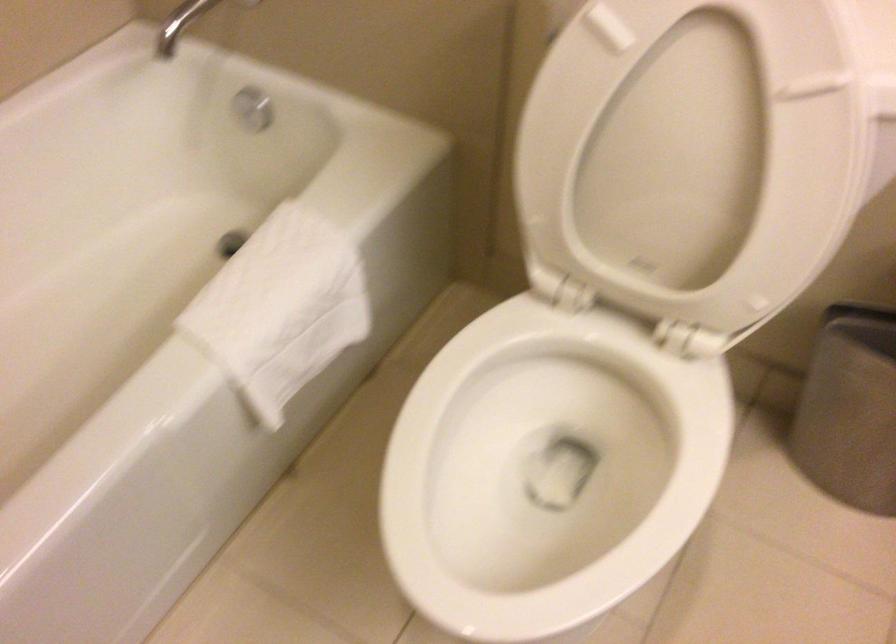
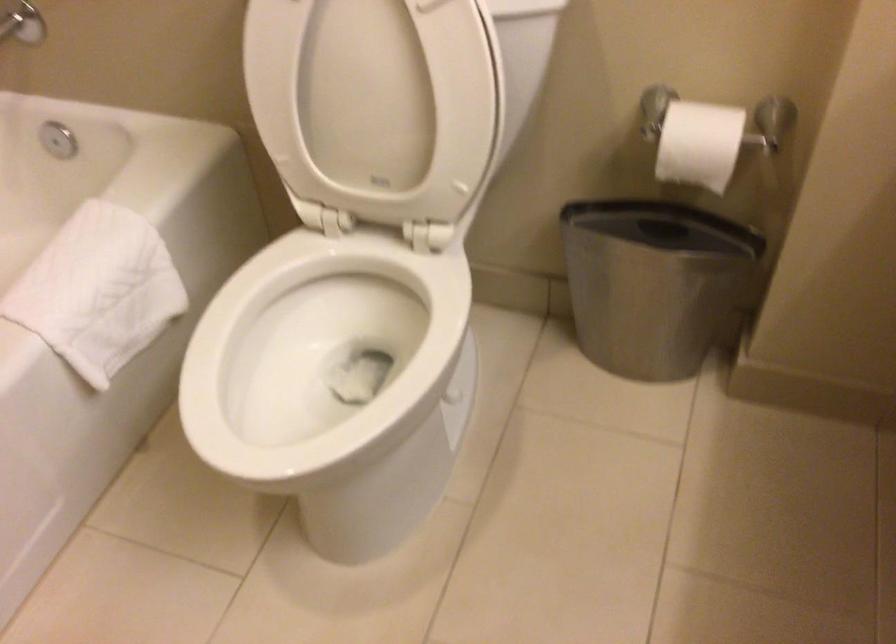
Question: The camera is either moving clockwise (left) or counter-clockwise (right) around the object. The first image is from the beginning of the video and the second image is from the end. Is the camera moving left or right when shooting the video?

Choices:
 (A) Left
 (B) Right

Answer: (A)